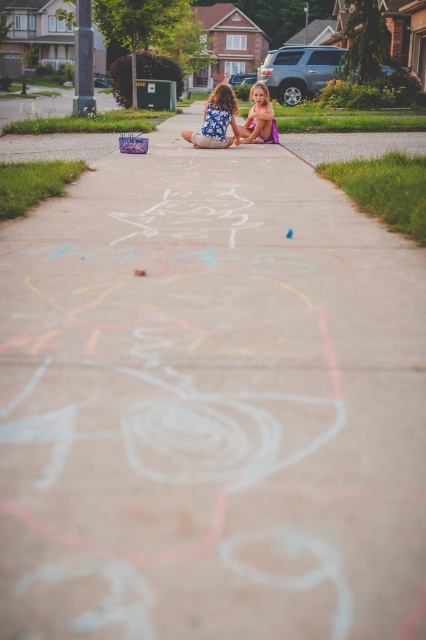
Question: Which of the following is the closest to the observer?

Choices:
 (A) (264, 92)
 (B) (215, 134)

Answer: (B)

Question: Which of the following is the farthest from the observer?

Choices:
 (A) 222,109
 (B) 258,125

Answer: (B)

Question: Can you confirm if blue floral dress at center is positioned below matte purple dress at center?

Choices:
 (A) no
 (B) yes

Answer: (B)

Question: Is the position of blue floral dress at center less distant than that of matte purple dress at center?

Choices:
 (A) no
 (B) yes

Answer: (B)

Question: Does blue floral dress at center appear over matte purple dress at center?

Choices:
 (A) no
 (B) yes

Answer: (A)

Question: Which point is farther to the camera?

Choices:
 (A) matte purple dress at center
 (B) blue floral dress at center

Answer: (A)